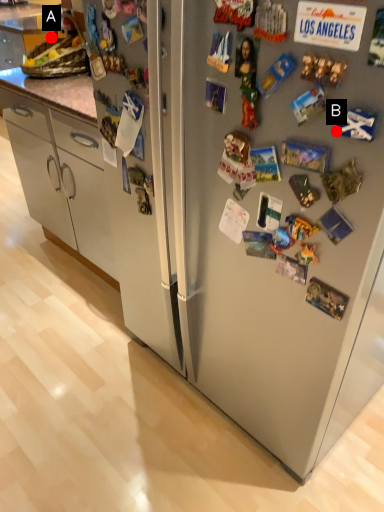
Question: Two points are circled on the image, labeled by A and B beside each circle. Which point is further to the camera?

Choices:
 (A) A is further
 (B) B is further

Answer: (A)